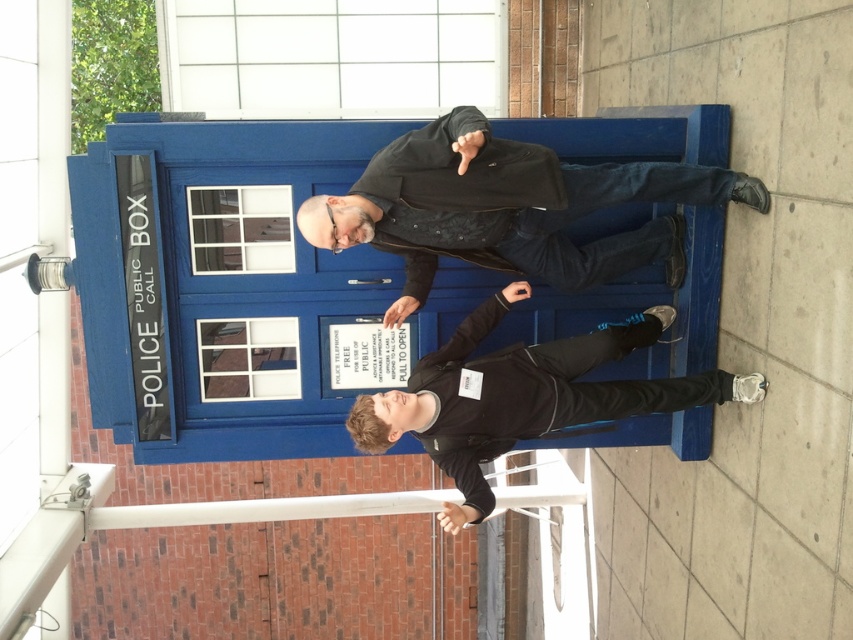
What is located at the coordinates point (508, 208) in the image?

The point (508, 208) is where the matte black jacket at center is located.

Based on the photo, you are standing in front of the TARDIS and notice two points marked in the scene. Which point is closer to you, point (498, 140) or point (366, 416)?

Point (498, 140) is closer to the viewer than point (366, 416).

You are an observer standing in front of the TARDIS. You notice two people wearing jackets. Which jacket, the matte black jacket at center or the black matte jacket at center, is shorter?

The matte black jacket at center is shorter than the black matte jacket at center.